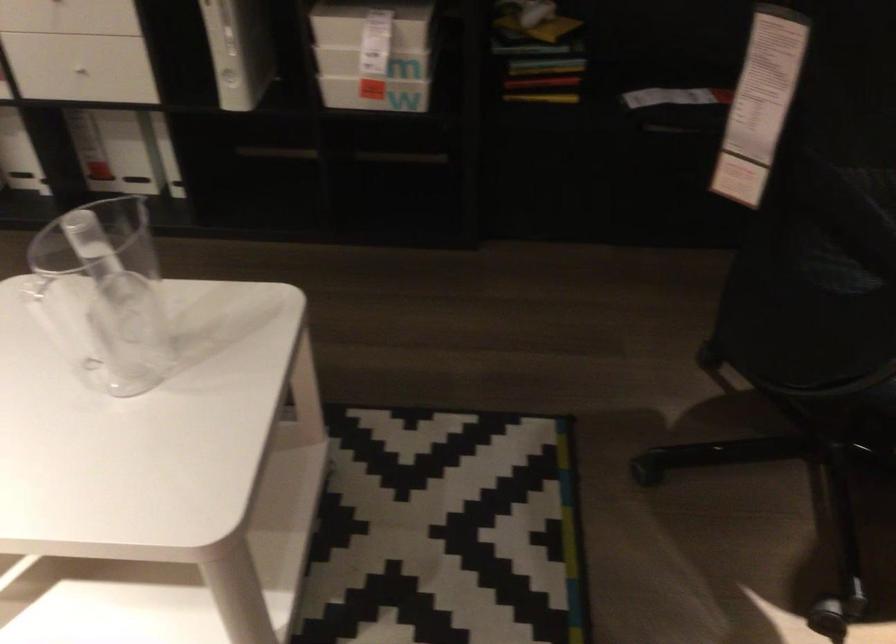
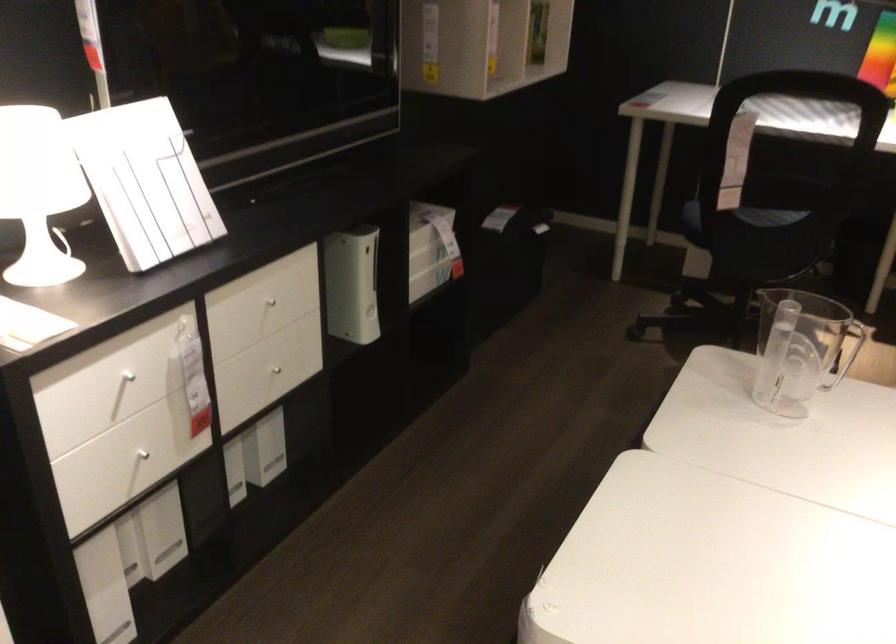
Where in the second image is the point corresponding to (650,161) from the first image?

(507, 263)